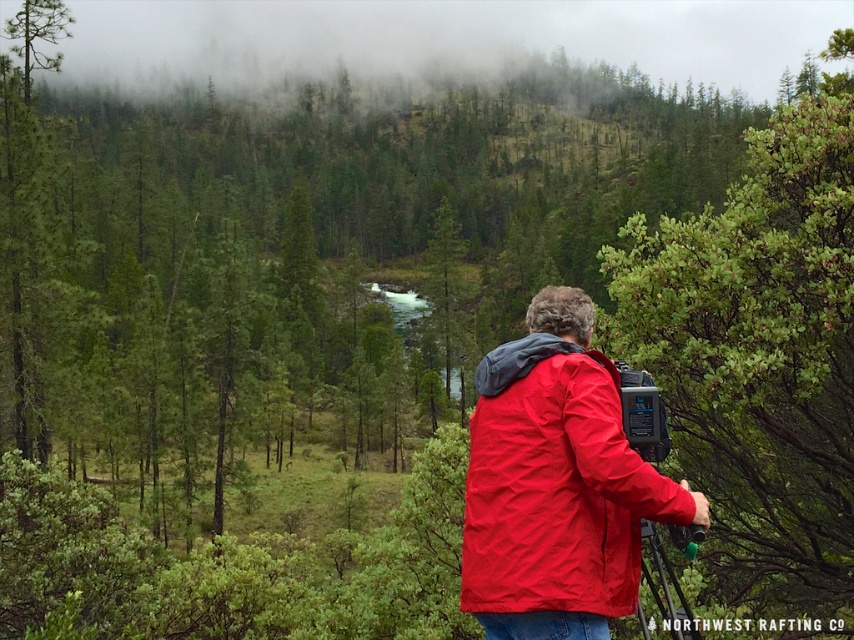
Can you confirm if red matte jacket at center is bigger than metallic tripod at center?

Yes, red matte jacket at center is bigger than metallic tripod at center.

Does point (496, 540) lie in front of point (674, 637)?

Yes, it is in front of point (674, 637).

This screenshot has width=854, height=640. Describe the element at coordinates (554, 484) in the screenshot. I see `red matte jacket at center` at that location.

You are a GUI agent. You are given a task and a screenshot of the screen. Output one action in this format:
    pyautogui.click(x=<x>, y=<y>)
    Task: Click on the red matte jacket at center
    This screenshot has height=640, width=854.
    Given the screenshot: What is the action you would take?
    pyautogui.click(x=554, y=484)

Is green leafy shrub at right closer to camera compared to metallic tripod at center?

No, green leafy shrub at right is behind metallic tripod at center.

Is green leafy shrub at right positioned at the back of metallic tripod at center?

Yes.

Is point (744, 202) farther from camera compared to point (671, 532)?

Yes, it is behind point (671, 532).

Locate an element on the screen. The width and height of the screenshot is (854, 640). green leafy shrub at right is located at coordinates (759, 352).

Does green leafy shrub at right appear under red matte jacket at center?

Incorrect, green leafy shrub at right is not positioned below red matte jacket at center.

Does green leafy shrub at right have a greater width compared to red matte jacket at center?

Correct, the width of green leafy shrub at right exceeds that of red matte jacket at center.

Is point (726, 484) positioned in front of point (463, 554)?

No, (726, 484) is further to viewer.

Where is `green leafy shrub at right`? green leafy shrub at right is located at coordinates (759, 352).